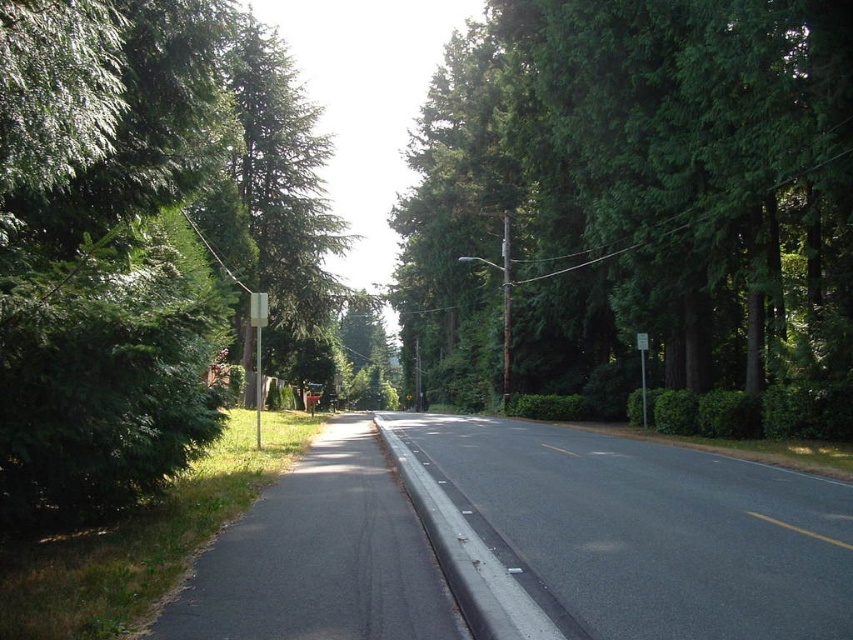
Question: Does green leafy tree at center appear on the right side of white plastic sign at center?

Choices:
 (A) no
 (B) yes

Answer: (B)

Question: Considering the real-world distances, which object is farthest from the green matte tree at left?

Choices:
 (A) white plastic street sign at center
 (B) green leafy tree at center

Answer: (A)

Question: In this image, where is white plastic sign at center located relative to white plastic street sign at center?

Choices:
 (A) left
 (B) right

Answer: (A)

Question: Which object is farther from the camera taking this photo?

Choices:
 (A) green matte tree at left
 (B) white plastic sign at center
 (C) green leafy tree at center

Answer: (B)

Question: Which object is the farthest from the white plastic sign at center?

Choices:
 (A) white plastic street sign at center
 (B) green matte tree at left
 (C) green leafy tree at center

Answer: (C)

Question: Does green leafy tree at center appear over green matte tree at left?

Choices:
 (A) no
 (B) yes

Answer: (A)